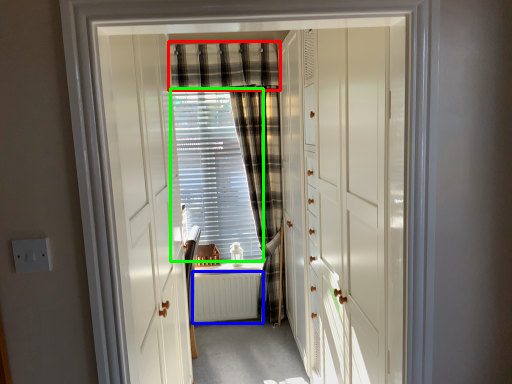
Question: Which object is positioned farthest from curtain (highlighted by a red box)? Select from radiator (highlighted by a blue box) and blind (highlighted by a green box).

Choices:
 (A) radiator
 (B) blind

Answer: (A)